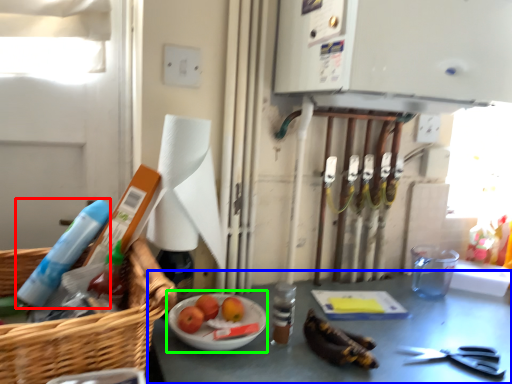
Question: Estimate the real-world distances between objects in this image. Which object is closer to cleaning product (highlighted by a red box), table (highlighted by a blue box) or fruit dish (highlighted by a green box)?

Choices:
 (A) table
 (B) fruit dish

Answer: (B)